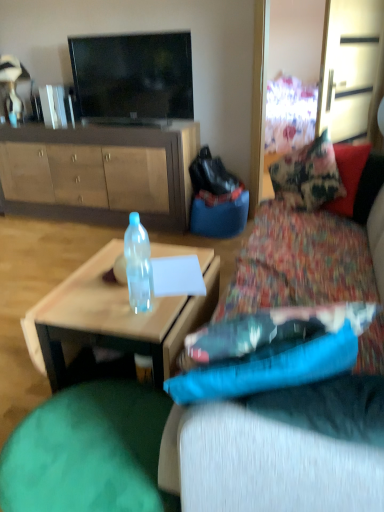
Question: From the image's perspective, is matte brown cabinet at center above or below flat screen tv at upper center?

Choices:
 (A) below
 (B) above

Answer: (A)

Question: Is matte brown cabinet at center bigger or smaller than flat screen tv at upper center?

Choices:
 (A) small
 (B) big

Answer: (B)

Question: Considering the real-world distances, which object is farthest from the textured fabric couch at center?

Choices:
 (A) flat screen tv at upper center
 (B) green fabric bean bag at lower left
 (C) matte brown cabinet at center
 (D) translucent plastic coffee table at center

Answer: (A)

Question: Which object is the closest to the flat screen tv at upper center?

Choices:
 (A) translucent plastic coffee table at center
 (B) textured fabric couch at center
 (C) matte brown cabinet at center
 (D) green fabric bean bag at lower left

Answer: (C)